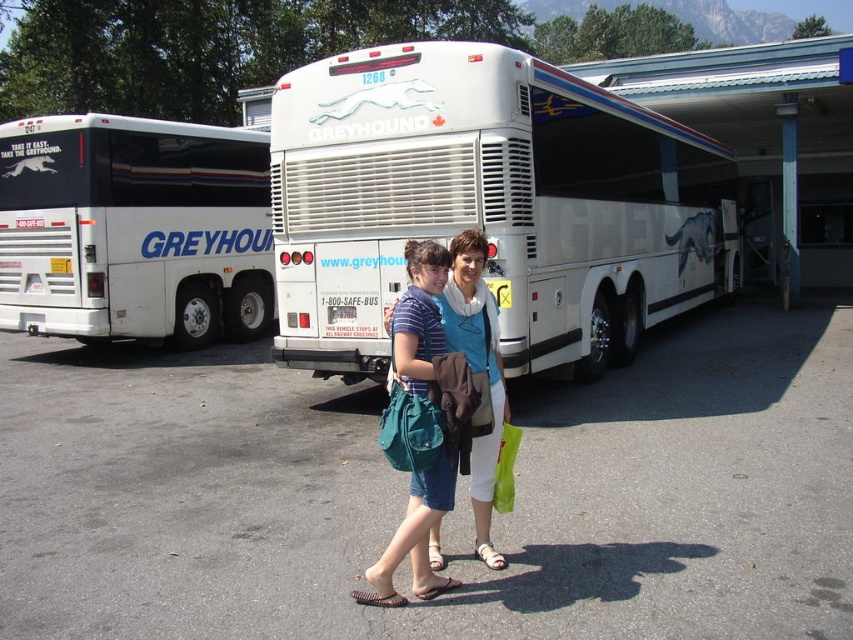
You are a photographer standing at the bus station. You want to take a photo of the white glossy bus at upper center and the teal fabric bag at center. If your camera has a maximum focus range of 15 meters, will both objects be in focus?

The distance between the white glossy bus at upper center and the teal fabric bag at center is 15.23 meters, which exceeds the camera maximum focus range of 15 meters. Therefore, both objects cannot be in focus at the same time.

You are a photographer at the bus station and want to frame a photo that includes both the white glossy bus at upper center and the teal fabric bag at center. Based on their positions, which object should be placed on the left side of the photo to ensure both are visible?

The teal fabric bag at center should be placed on the left side of the photo because the white glossy bus at upper center is to the right of it, ensuring both are visible in the frame.